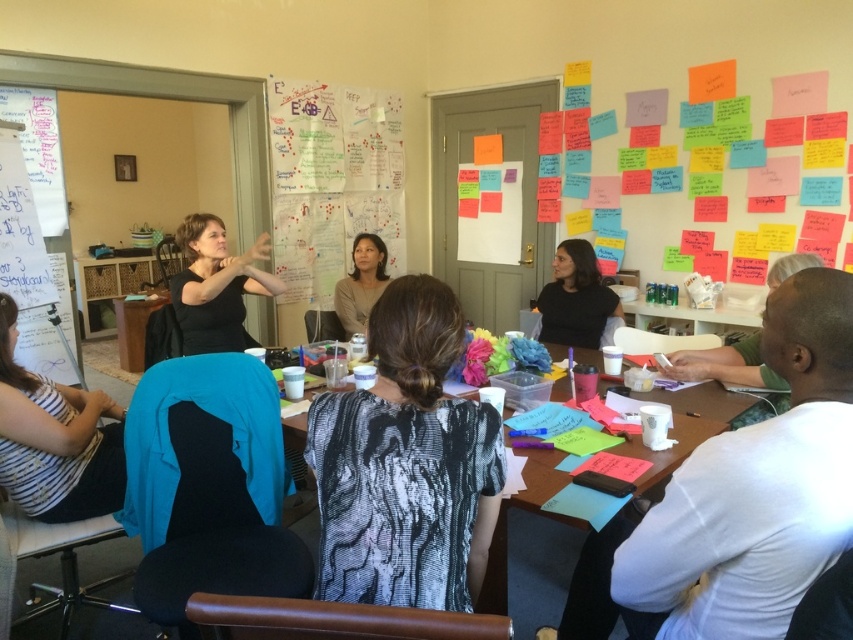
Does whiteboard at left come in front of black matte shirt at left?

No, it is not.

Is whiteboard at left wider than black matte shirt at left?

Incorrect, whiteboard at left's width does not surpass black matte shirt at left's.

Measure the distance between point (45, 305) and camera.

They are 10.92 feet apart.

This screenshot has width=853, height=640. In order to click on whiteboard at left in this screenshot , I will do `click(28, 266)`.

Who is positioned more to the left, wooden table at center or black matte shirt at left?

Positioned to the left is black matte shirt at left.

Is wooden table at center thinner than black matte shirt at left?

Incorrect, wooden table at center's width is not less than black matte shirt at left's.

The image size is (853, 640). Describe the element at coordinates (531, 564) in the screenshot. I see `wooden table at center` at that location.

You are a GUI agent. You are given a task and a screenshot of the screen. Output one action in this format:
    pyautogui.click(x=<x>, y=<y>)
    Task: Click on the wooden table at center
    This screenshot has width=853, height=640.
    Given the screenshot: What is the action you would take?
    pyautogui.click(x=531, y=564)

Who is taller, wooden table at center or matte black shirt at center?

Standing taller between the two is wooden table at center.

Between wooden table at center and matte black shirt at center, which one has less height?

matte black shirt at center is shorter.

At what (x,y) coordinates should I click in order to perform the action: click on wooden table at center. Please return your answer as a coordinate pair (x, y). Looking at the image, I should click on (531, 564).

The width and height of the screenshot is (853, 640). In order to click on wooden table at center in this screenshot , I will do `click(531, 564)`.